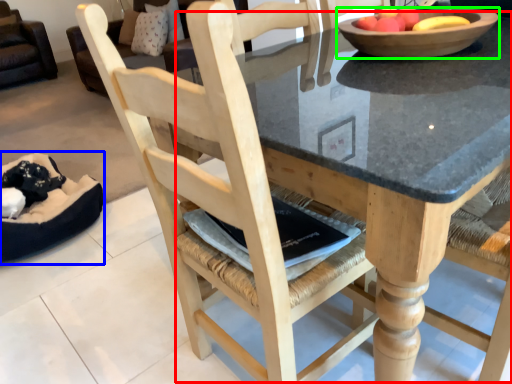
Question: Which object is positioned closest to round table (highlighted by a red box)? Select from bean bag chair (highlighted by a blue box) and bowl (highlighted by a green box).

Choices:
 (A) bean bag chair
 (B) bowl

Answer: (B)